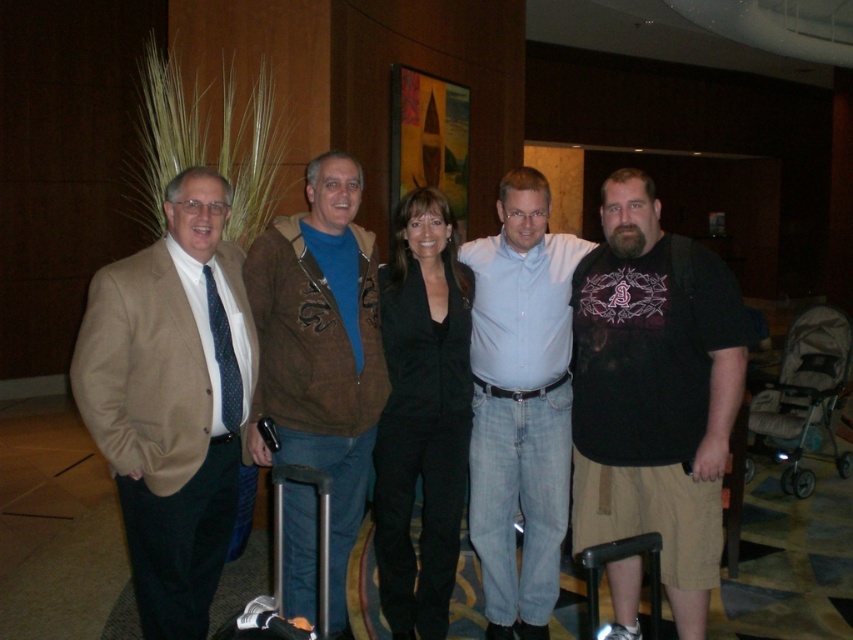
What is the color of the clothing item located at the coordinates point (654, 392) in the image?

The point (654, 392) corresponds to the black cotton t shirt at center, so the clothing item there is black.